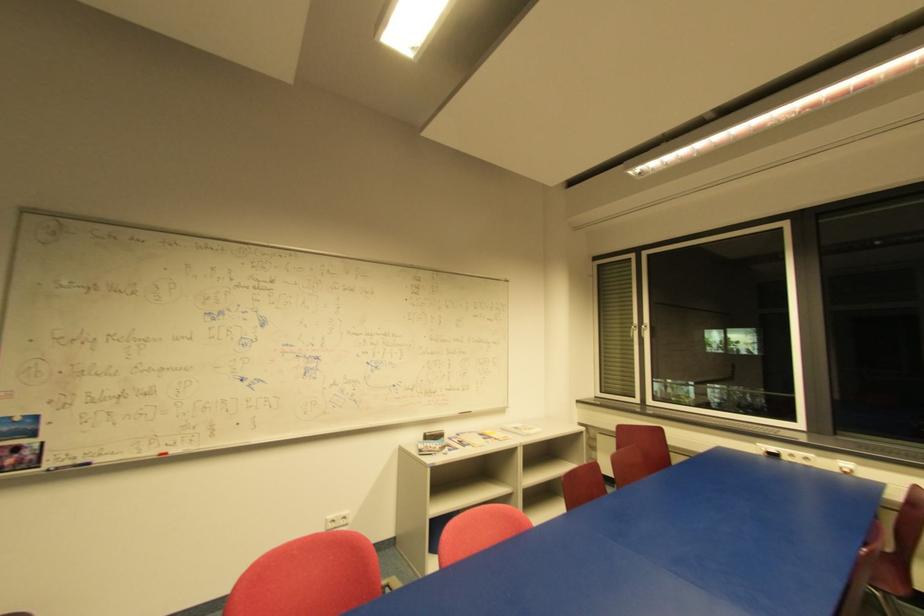
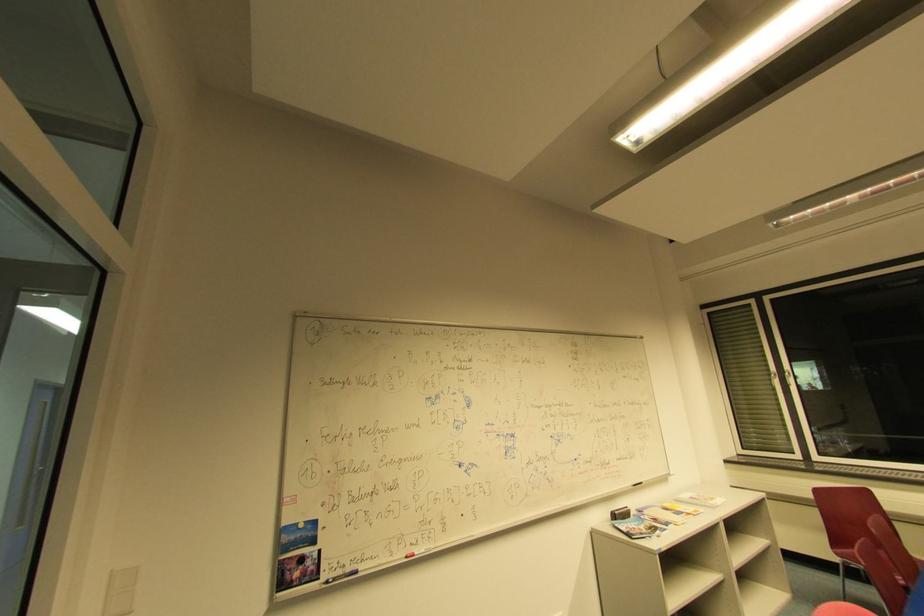
In the second image, find the point that corresponds to (x=488, y=440) in the first image.

(679, 515)